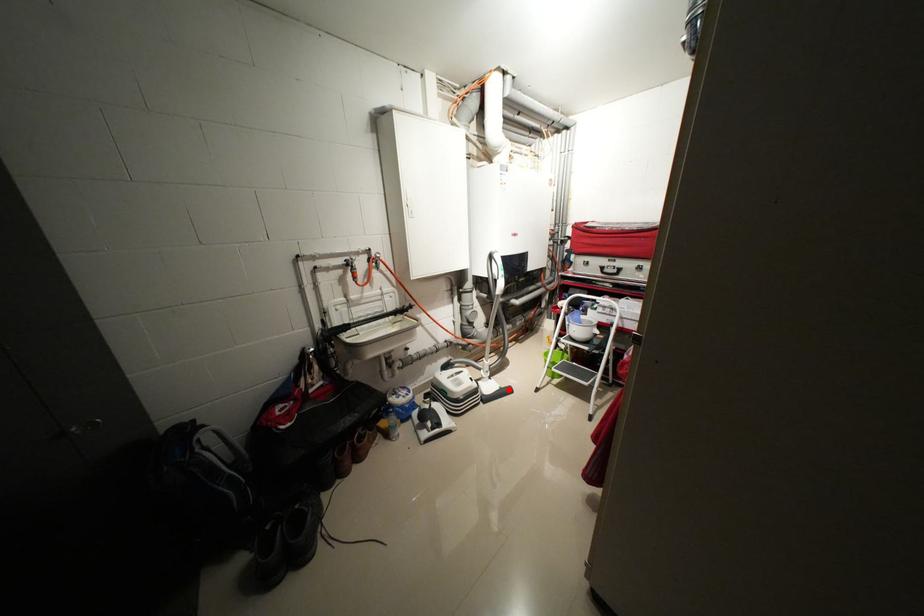
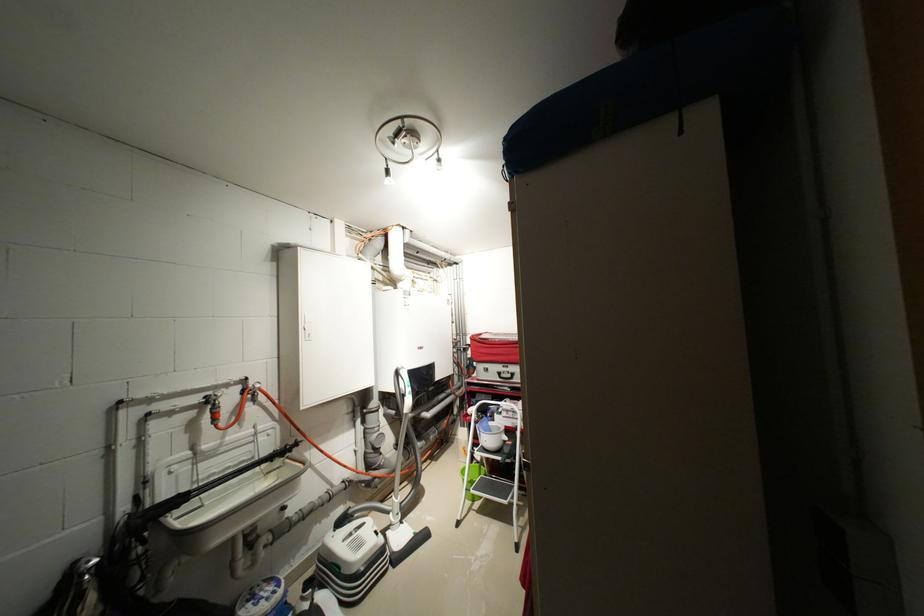
The point at the highlighted location is marked in the first image. Where is the corresponding point in the second image?

(423, 536)